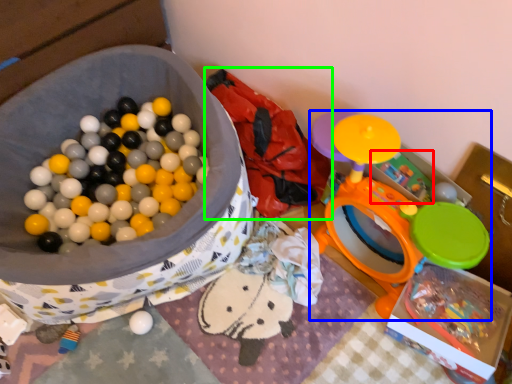
Question: Considering the real-world distances, which object is farthest from toy (highlighted by a red box)? toy (highlighted by a blue box) or bean bag chair (highlighted by a green box)?

Choices:
 (A) toy
 (B) bean bag chair

Answer: (B)